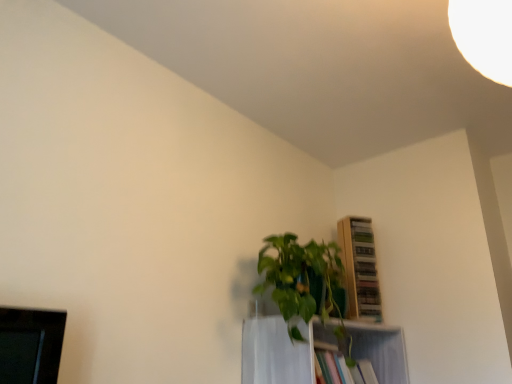
Question: In terms of size, does white glossy shelf at center, which is counted as the second shelf, starting from the top, appear bigger or smaller than wooden shelf at upper right, which ranks as the 1th shelf in top-to-bottom order?

Choices:
 (A) small
 (B) big

Answer: (B)

Question: Is point pyautogui.click(x=391, y=329) closer or farther from the camera than point pyautogui.click(x=369, y=301)?

Choices:
 (A) farther
 (B) closer

Answer: (B)

Question: Considering the real-world distances, which object is closest to the wooden shelf at upper right, which ranks as the 1th shelf in top-to-bottom order?

Choices:
 (A) green leafy plant at center
 (B) white glossy shelf at center, which is counted as the second shelf, starting from the top

Answer: (B)

Question: Estimate the real-world distances between objects in this image. Which object is closer to the white glossy shelf at center, which is counted as the second shelf, starting from the top?

Choices:
 (A) wooden shelf at upper right, the 2th shelf ordered from the bottom
 (B) green leafy plant at center

Answer: (B)